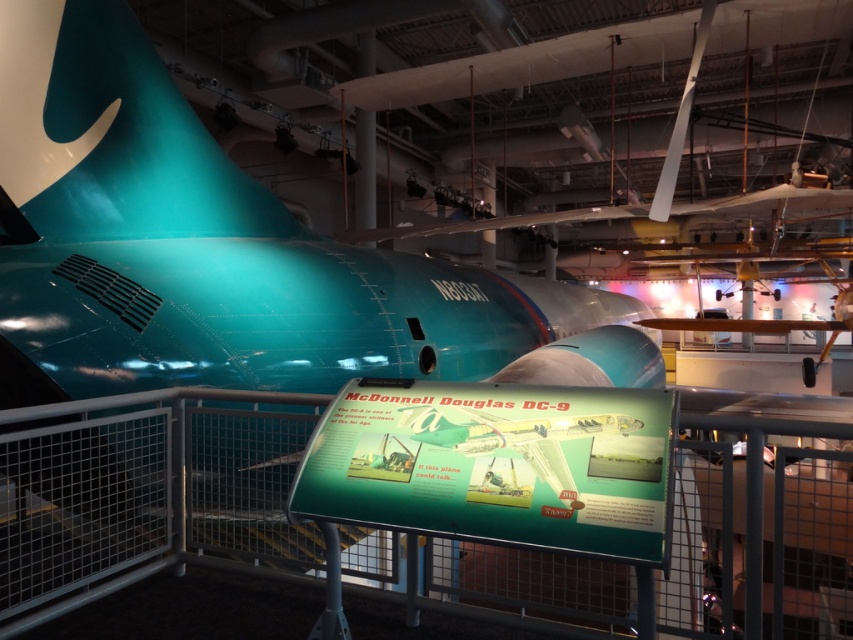
Question: Is teal glossy airplane at center smaller than wooden propeller at upper center?

Choices:
 (A) no
 (B) yes

Answer: (B)

Question: Which point appears closest to the camera in this image?

Choices:
 (A) (660, 323)
 (B) (68, 259)

Answer: (B)

Question: Which point appears farthest from the camera in this image?

Choices:
 (A) (849, 316)
 (B) (213, 147)

Answer: (A)

Question: Can you confirm if teal glossy airplane at center is positioned to the right of wooden propeller at upper center?

Choices:
 (A) no
 (B) yes

Answer: (A)

Question: Considering the relative positions of teal glossy airplane at center and wooden propeller at upper center in the image provided, where is teal glossy airplane at center located with respect to wooden propeller at upper center?

Choices:
 (A) left
 (B) right

Answer: (A)